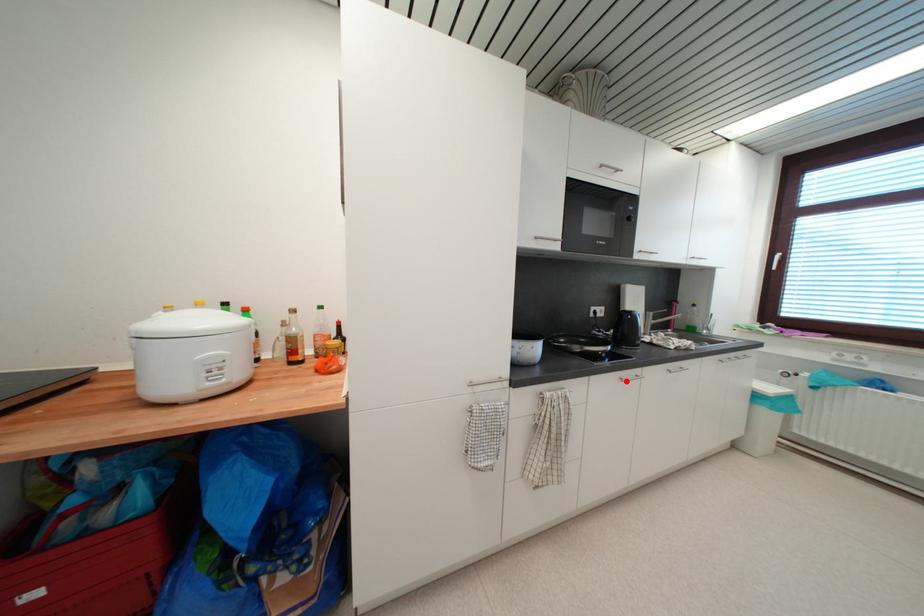
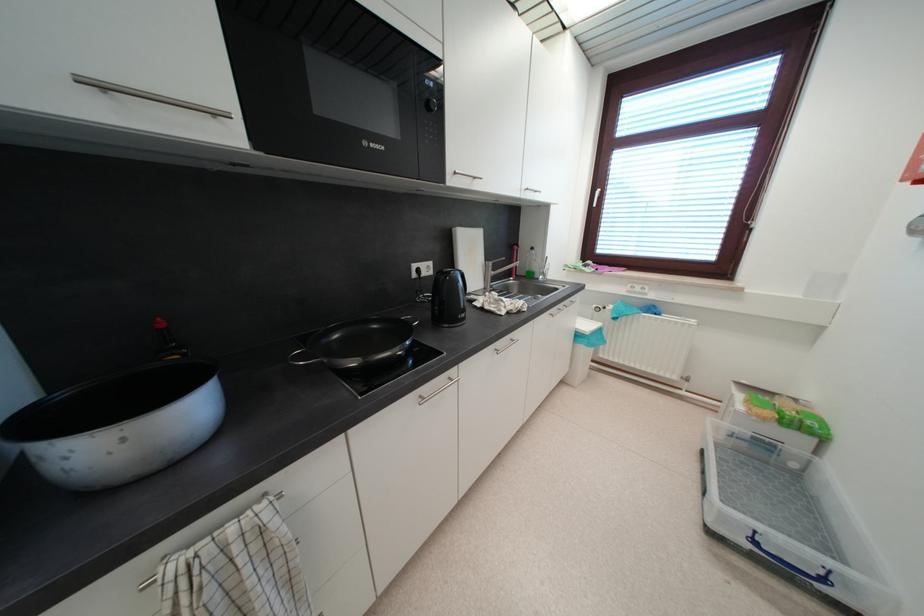
Find the pixel in the second image that matches the highlighted location in the first image.

(427, 400)